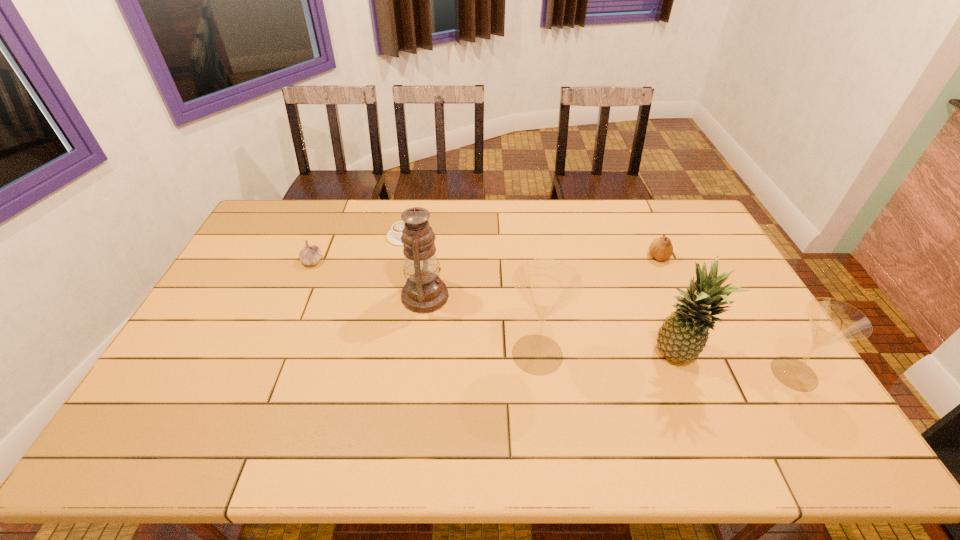
All flute glasss are currently evenly spaced. To continue this pattern, where would you add another flute glass on the left? Please point out a vacant spot. Please provide its 2D coordinates. Your answer should be formatted as a tuple, i.e. [(x, y)], where the tuple contains the x and y coordinates of a point satisfying the conditions above.

[(300, 336)]